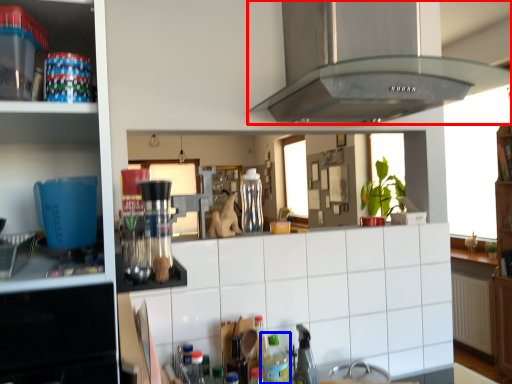
Question: Which object is further to the camera taking this photo, home appliance (highlighted by a red box) or bottle (highlighted by a blue box)?

Choices:
 (A) home appliance
 (B) bottle

Answer: (B)